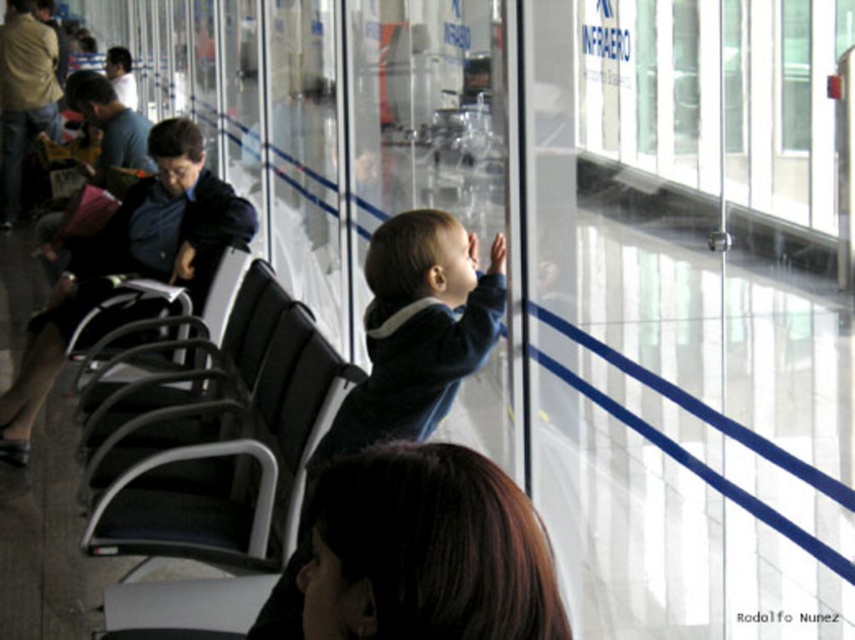
Who is more distant from viewer, [186,554] or [428,259]?

Positioned behind is point [186,554].

Is black fabric chair at center further to camera compared to dark blue sweater at center?

Yes, black fabric chair at center is further from the viewer.

Is point (187, 433) positioned in front of point (441, 269)?

No, (187, 433) is further to viewer.

The image size is (855, 640). I want to click on black fabric chair at center, so click(222, 461).